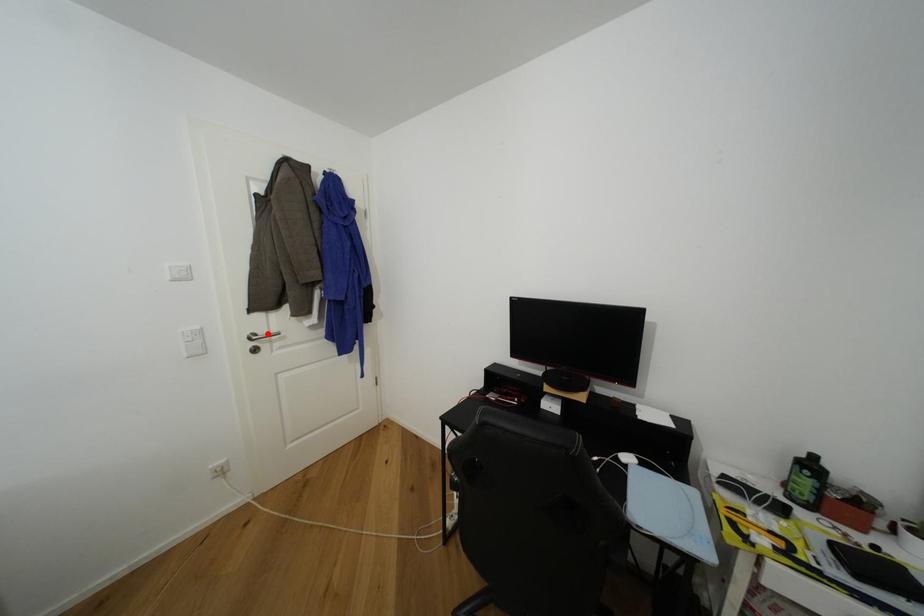
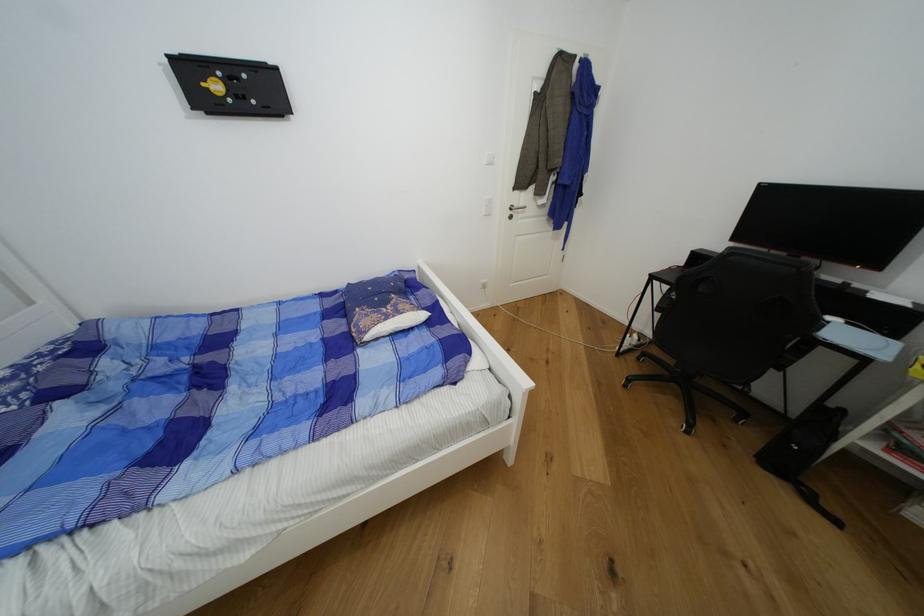
Question: I am providing you with two images of the same scene from different viewpoints. A red point is marked on the first image. At the location where the point appears in image 1, is it still visible in image 2?

Choices:
 (A) Yes
 (B) No

Answer: (A)